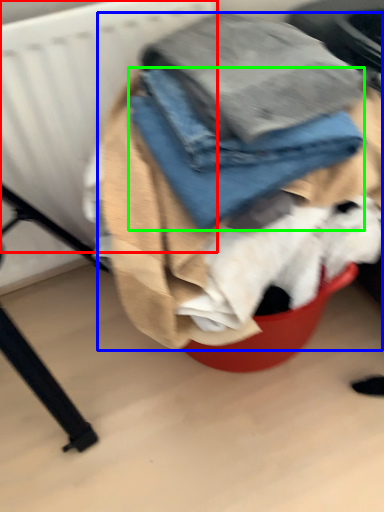
Question: Which object is the closest to the radiator (highlighted by a red box)? Choose among these: laundry (highlighted by a blue box) or trousers (highlighted by a green box).

Choices:
 (A) laundry
 (B) trousers

Answer: (A)